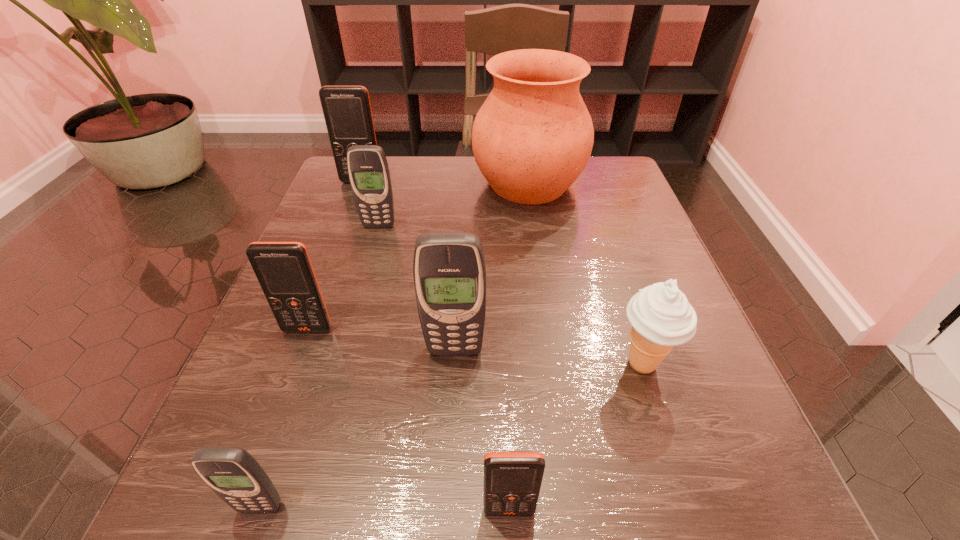
The image size is (960, 540). I want to click on vacant area that lies between the tallest object and the farthest orange cellular telephone, so click(445, 183).

Locate an element on the screen. The image size is (960, 540). object that stands as the fifth closest to the rightmost orange cellular telephone is located at coordinates (368, 170).

Point out which object is positioned as the seventh nearest to the nearest gray cellular telephone. Please provide its 2D coordinates. Your answer should be formatted as a tuple, i.e. [(x, y)], where the tuple contains the x and y coordinates of a point satisfying the conditions above.

[(347, 111)]

In order to click on cellular telephone that is the fifth closest to the third nearest cellular telephone in this screenshot , I will do `click(347, 111)`.

You are a GUI agent. You are given a task and a screenshot of the screen. Output one action in this format:
    pyautogui.click(x=<x>, y=<y>)
    Task: Click on the cellular telephone that stands as the fourth closest to the sixth nearest object
    Image resolution: width=960 pixels, height=540 pixels.
    Given the screenshot: What is the action you would take?
    pyautogui.click(x=232, y=473)

Image resolution: width=960 pixels, height=540 pixels. What are the coordinates of `the third closest orange cellular telephone to the fourth farthest cellular telephone` in the screenshot? It's located at (347, 111).

Where is `orange cellular telephone that is the closest to the rightmost gray cellular telephone`? This screenshot has width=960, height=540. orange cellular telephone that is the closest to the rightmost gray cellular telephone is located at coordinates (284, 270).

Where is `gray cellular telephone that is the closest to the smallest orange cellular telephone`? The height and width of the screenshot is (540, 960). gray cellular telephone that is the closest to the smallest orange cellular telephone is located at coordinates (449, 268).

This screenshot has height=540, width=960. I want to click on gray cellular telephone that stands as the closest to the biggest gray cellular telephone, so click(x=232, y=473).